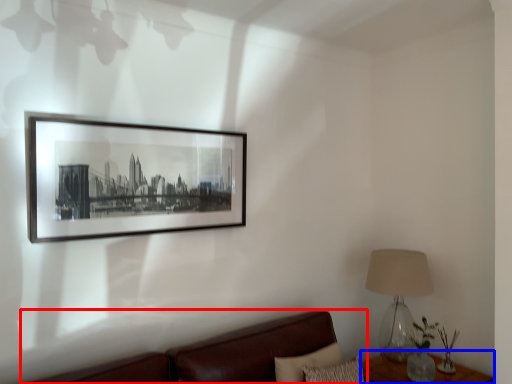
Question: Which of the following is the farthest to the observer, studio couch (highlighted by a red box) or table (highlighted by a blue box)?

Choices:
 (A) studio couch
 (B) table

Answer: (B)